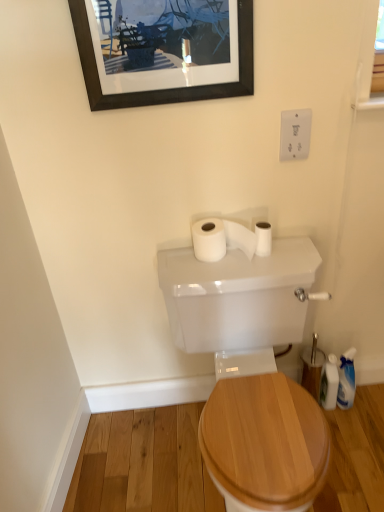
Where is `vacant area that lies in front of white matte toilet paper at upper center, the second toilet paper in the left-to-right sequence`? The height and width of the screenshot is (512, 384). vacant area that lies in front of white matte toilet paper at upper center, the second toilet paper in the left-to-right sequence is located at coordinates (263, 268).